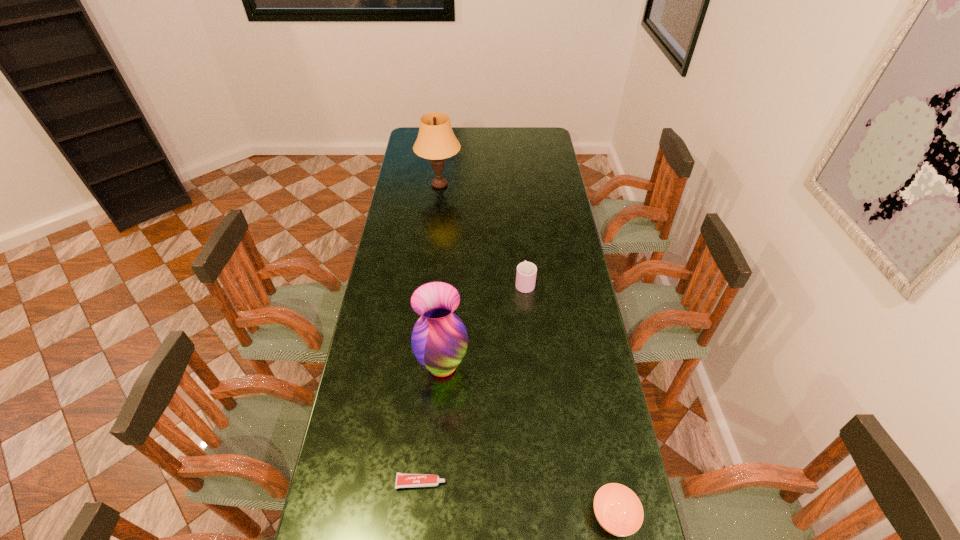
In order to click on vacant space positioned 0.280m with the handle on the side of the second farthest object in this screenshot , I will do `click(519, 227)`.

You are a GUI agent. You are given a task and a screenshot of the screen. Output one action in this format:
    pyautogui.click(x=<x>, y=<y>)
    Task: Click on the vacant region located 0.240m at the nozzle of the fourth farthest object
    This screenshot has width=960, height=540.
    Given the screenshot: What is the action you would take?
    pyautogui.click(x=536, y=482)

Where is `object at the left edge`? object at the left edge is located at coordinates (436, 141).

You are a GUI agent. You are given a task and a screenshot of the screen. Output one action in this format:
    pyautogui.click(x=<x>, y=<y>)
    Task: Click on the vacant space at the far edge of the desktop
    
    Given the screenshot: What is the action you would take?
    pyautogui.click(x=500, y=149)

This screenshot has width=960, height=540. In order to click on vacant space at the left edge in this screenshot , I will do `click(368, 460)`.

Locate an element on the screen. vacant space at the right edge is located at coordinates (540, 168).

Where is `free space between the fourth nearest object and the fourth farthest object`? The image size is (960, 540). free space between the fourth nearest object and the fourth farthest object is located at coordinates (473, 382).

In order to click on vacant area that lies between the second nearest object and the vase in this screenshot , I will do `click(432, 424)`.

This screenshot has width=960, height=540. Find the location of `free space between the third farthest object and the second object from right to left`. free space between the third farthest object and the second object from right to left is located at coordinates (484, 324).

Locate an element on the screen. The image size is (960, 540). free spot between the third shortest object and the lampshade is located at coordinates (482, 234).